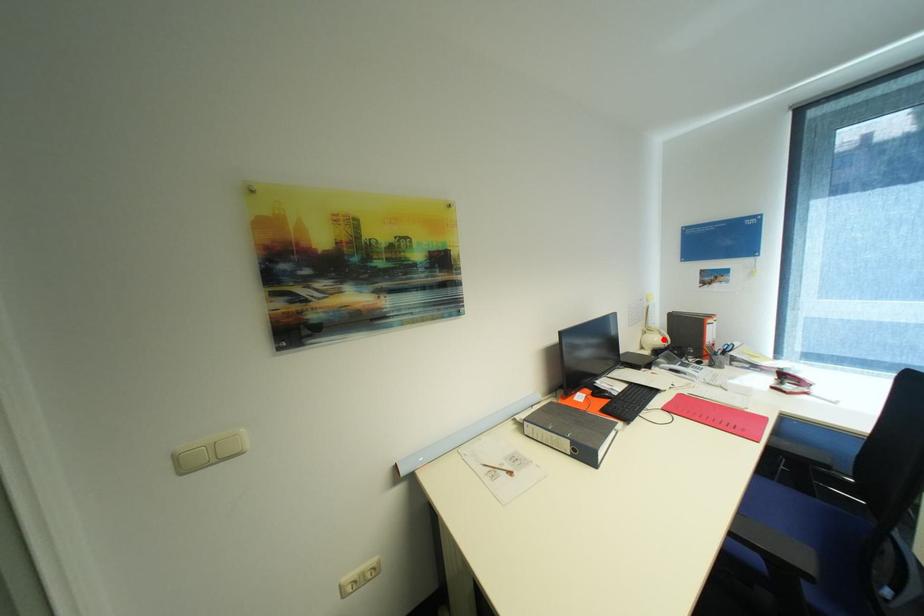
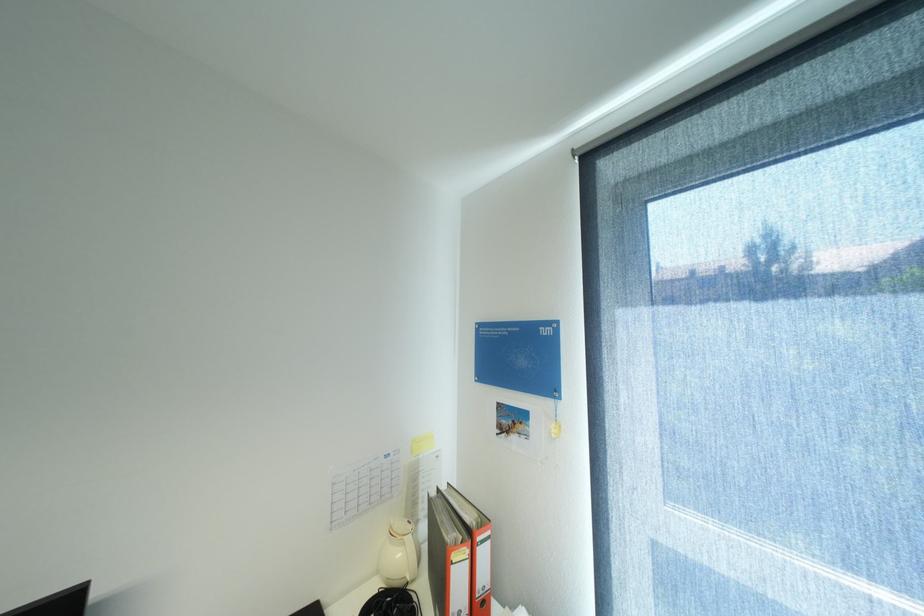
In the second image, find the point that corresponds to the highlighted location in the first image.

(407, 554)